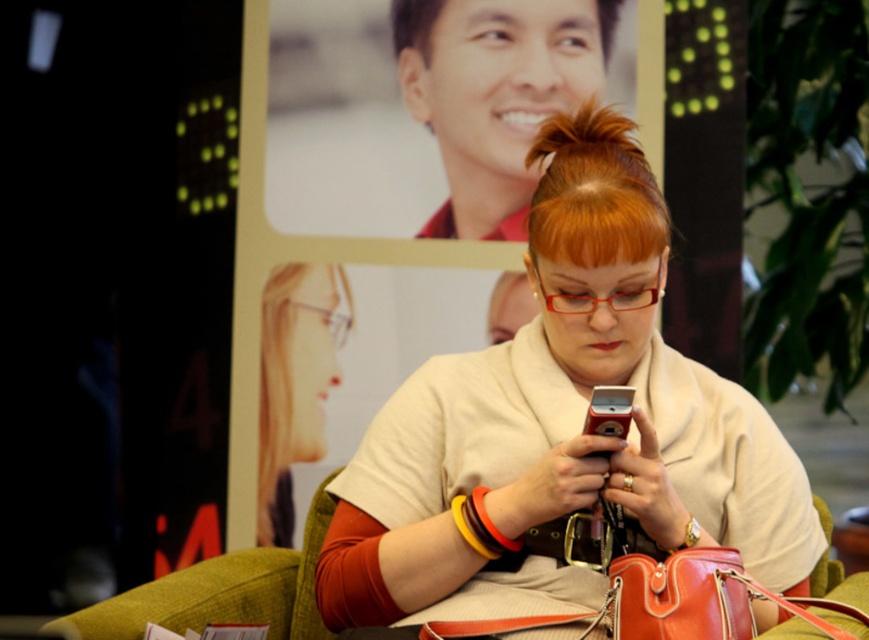
Is matte beige sweater at center to the left of brown matte hair at upper center from the viewer's perspective?

In fact, matte beige sweater at center is to the right of brown matte hair at upper center.

Where is `matte beige sweater at center`? matte beige sweater at center is located at coordinates (561, 424).

You are a GUI agent. You are given a task and a screenshot of the screen. Output one action in this format:
    pyautogui.click(x=<x>, y=<y>)
    Task: Click on the matte beige sweater at center
    Image resolution: width=869 pixels, height=640 pixels.
    Given the screenshot: What is the action you would take?
    pyautogui.click(x=561, y=424)

Does clear plastic glasses at upper left lie behind shiny orange handbag at lower center?

Yes, it is behind shiny orange handbag at lower center.

Which is in front, point (260, 412) or point (455, 628)?

Point (455, 628)

What are the coordinates of `clear plastic glasses at upper left` in the screenshot? It's located at (295, 381).

What do you see at coordinates (413, 24) in the screenshot?
I see `brown matte hair at upper center` at bounding box center [413, 24].

Is brown matte hair at upper center above metallic silver phone at center?

Yes, brown matte hair at upper center is above metallic silver phone at center.

Identify the location of brown matte hair at upper center. Image resolution: width=869 pixels, height=640 pixels. (413, 24).

Identify the location of brown matte hair at upper center. (413, 24).